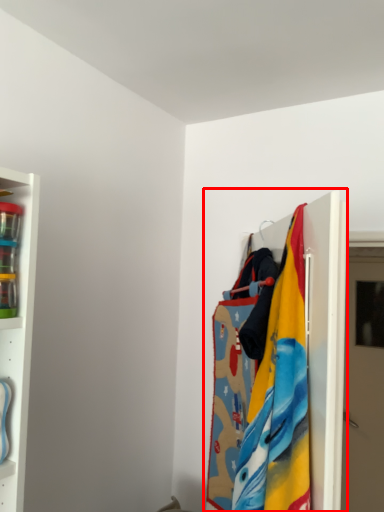
Question: Considering the relative positions of closet (annotated by the red box) and door in the image provided, where is closet (annotated by the red box) located with respect to the staircase?

Choices:
 (A) left
 (B) right

Answer: (A)